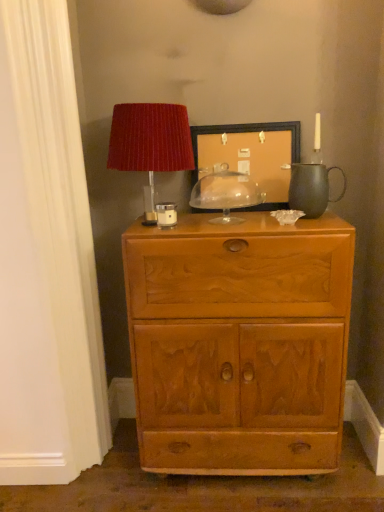
Question: Is clear glass dome at center, which appears as the first candle holder when viewed from the back, wider than matte white candle holder at upper center, the 2th candle holder from the back?

Choices:
 (A) yes
 (B) no

Answer: (A)

Question: Would you say matte white candle holder at upper center, the first candle holder in the front-to-back sequence, is part of clear glass dome at center, which appears as the first candle holder when viewed from the back,'s contents?

Choices:
 (A) no
 (B) yes

Answer: (A)

Question: From the image's perspective, does clear glass dome at center, which appears as the first candle holder when viewed from the back, appear lower than matte white candle holder at upper center, the 2th candle holder from the right?

Choices:
 (A) no
 (B) yes

Answer: (A)

Question: From a real-world perspective, is clear glass dome at center, positioned as the 2th candle holder in left-to-right order, located higher than matte white candle holder at upper center, the first candle holder in the front-to-back sequence?

Choices:
 (A) no
 (B) yes

Answer: (B)

Question: Is clear glass dome at center, arranged as the 1th candle holder when viewed from the right, at the right side of matte white candle holder at upper center, the first candle holder in the front-to-back sequence?

Choices:
 (A) yes
 (B) no

Answer: (A)

Question: Is matte white candle holder at upper center, the first candle holder in the front-to-back sequence, in front of or behind wooden picture frame at center in the image?

Choices:
 (A) front
 (B) behind

Answer: (A)

Question: In terms of size, does matte white candle holder at upper center, the first candle holder in the front-to-back sequence, appear bigger or smaller than wooden picture frame at center?

Choices:
 (A) big
 (B) small

Answer: (B)

Question: In terms of height, does matte white candle holder at upper center, the 2th candle holder from the right, look taller or shorter compared to wooden picture frame at center?

Choices:
 (A) short
 (B) tall

Answer: (A)

Question: Would you say matte white candle holder at upper center, the first candle holder in the front-to-back sequence, is inside or outside wooden picture frame at center?

Choices:
 (A) outside
 (B) inside

Answer: (A)

Question: Considering the positions of point (238, 205) and point (175, 216), is point (238, 205) closer or farther from the camera than point (175, 216)?

Choices:
 (A) closer
 (B) farther

Answer: (B)

Question: From a real-world perspective, is clear glass dome at center, which appears as the first candle holder when viewed from the back, above or below matte white candle holder at upper center, the 2th candle holder from the right?

Choices:
 (A) below
 (B) above

Answer: (B)

Question: Is clear glass dome at center, positioned as the 2th candle holder in left-to-right order, bigger or smaller than matte white candle holder at upper center, the first candle holder in the front-to-back sequence?

Choices:
 (A) big
 (B) small

Answer: (A)

Question: From the image's perspective, is clear glass dome at center, positioned as the 2th candle holder in left-to-right order, located above or below matte white candle holder at upper center, the first candle holder in the front-to-back sequence?

Choices:
 (A) below
 (B) above

Answer: (B)

Question: In terms of width, does light brown wood chest of drawers at center look wider or thinner when compared to wooden picture frame at center?

Choices:
 (A) thin
 (B) wide

Answer: (B)

Question: Considering the relative positions of light brown wood chest of drawers at center and wooden picture frame at center in the image provided, is light brown wood chest of drawers at center to the left or to the right of wooden picture frame at center?

Choices:
 (A) left
 (B) right

Answer: (A)